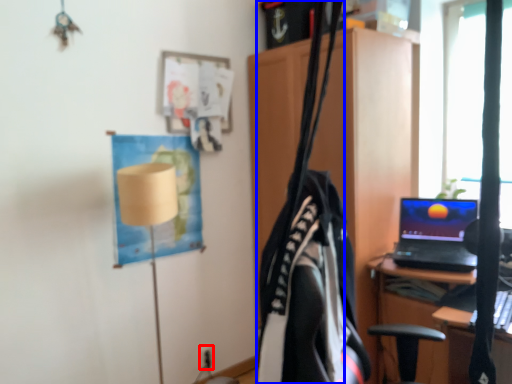
Question: Which object appears farthest to the camera in this image, electric outlet (highlighted by a red box) or clothesline (highlighted by a blue box)?

Choices:
 (A) electric outlet
 (B) clothesline

Answer: (A)